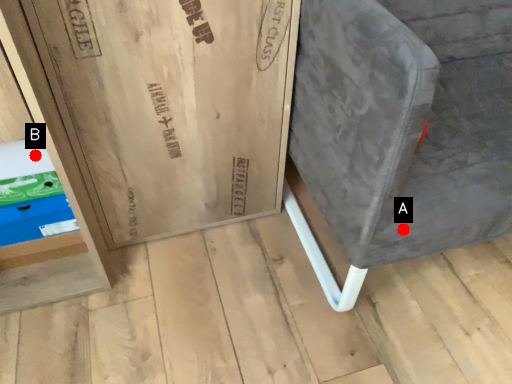
Question: Two points are circled on the image, labeled by A and B beside each circle. Which of the following is the farthest from the observer?

Choices:
 (A) A is further
 (B) B is further

Answer: (B)